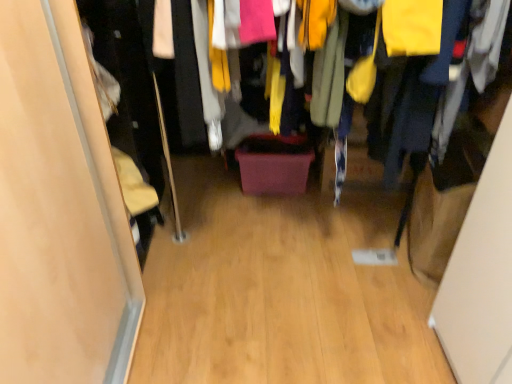
Question: From a real-world perspective, is wooden floor at center located beneath wooden floor at center?

Choices:
 (A) yes
 (B) no

Answer: (B)

Question: Could wooden floor at center be considered to be inside wooden floor at center?

Choices:
 (A) no
 (B) yes

Answer: (A)

Question: Considering the relative sizes of wooden floor at center and wooden floor at center in the image provided, is wooden floor at center taller than wooden floor at center?

Choices:
 (A) yes
 (B) no

Answer: (A)

Question: Is wooden floor at center positioned far away from wooden floor at center?

Choices:
 (A) yes
 (B) no

Answer: (B)

Question: Does wooden floor at center have a lesser width compared to wooden floor at center?

Choices:
 (A) no
 (B) yes

Answer: (B)

Question: In terms of width, does matte wood door at left look wider or thinner when compared to wooden floor at center?

Choices:
 (A) thin
 (B) wide

Answer: (A)

Question: Is point (1, 357) positioned closer to the camera than point (209, 284)?

Choices:
 (A) closer
 (B) farther

Answer: (A)

Question: Is matte wood door at left bigger or smaller than wooden floor at center?

Choices:
 (A) big
 (B) small

Answer: (A)

Question: From a real-world perspective, is matte wood door at left physically located above or below wooden floor at center?

Choices:
 (A) below
 (B) above

Answer: (B)

Question: Considering the positions of point (130, 147) and point (55, 41), is point (130, 147) closer or farther from the camera than point (55, 41)?

Choices:
 (A) closer
 (B) farther

Answer: (B)

Question: In terms of height, does wooden floor at center look taller or shorter compared to matte wood door at left?

Choices:
 (A) short
 (B) tall

Answer: (A)

Question: Is wooden floor at center bigger or smaller than matte wood door at left?

Choices:
 (A) small
 (B) big

Answer: (B)

Question: Based on their positions, is wooden floor at center located to the left or right of matte wood door at left?

Choices:
 (A) left
 (B) right

Answer: (B)

Question: Considering the positions of point (166, 97) and point (330, 382), is point (166, 97) closer or farther from the camera than point (330, 382)?

Choices:
 (A) closer
 (B) farther

Answer: (B)

Question: Considering the relative positions of wooden floor at center and wooden floor at center in the image provided, is wooden floor at center to the left or to the right of wooden floor at center?

Choices:
 (A) right
 (B) left

Answer: (A)